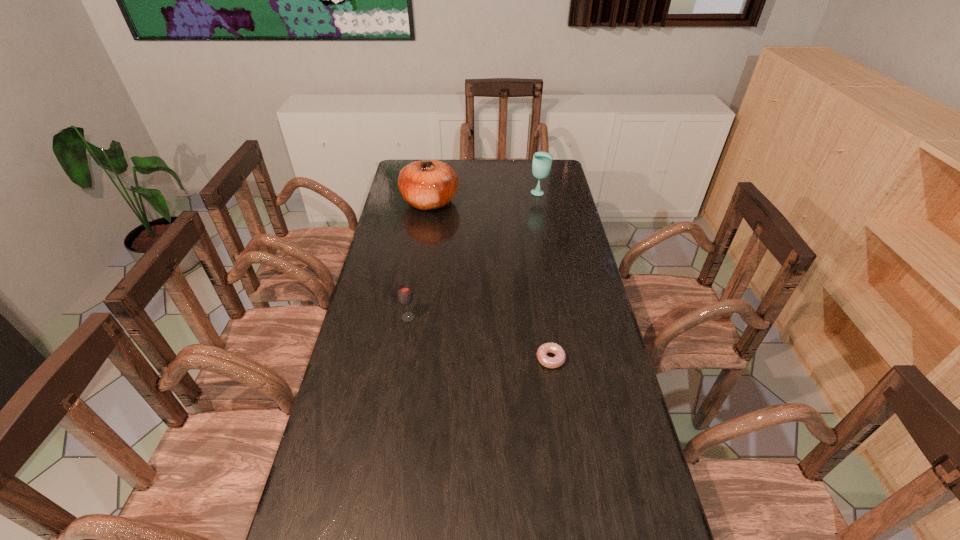
I want to click on unoccupied area between the right glass drink container and the second nearest object, so click(x=474, y=255).

The width and height of the screenshot is (960, 540). In order to click on empty space that is in between the pumpkin and the second shortest object in this screenshot , I will do `click(420, 260)`.

Locate an element on the screen. This screenshot has height=540, width=960. empty space that is in between the pumpkin and the nearer glass drink container is located at coordinates (420, 260).

Find the location of a particular element. free spot between the nearer glass drink container and the pumpkin is located at coordinates (420, 260).

Image resolution: width=960 pixels, height=540 pixels. In order to click on empty space between the pumpkin and the taller glass drink container in this screenshot , I will do `click(485, 197)`.

Find the location of a particular element. The width and height of the screenshot is (960, 540). free space that is in between the pumpkin and the shortest object is located at coordinates (491, 280).

Where is `object that is the second closest to the left glass drink container`? object that is the second closest to the left glass drink container is located at coordinates (430, 184).

Find the location of a particular element. The width and height of the screenshot is (960, 540). the third closest object to the farther glass drink container is located at coordinates (550, 362).

The image size is (960, 540). In order to click on vacant area that satisfies the following two spatial constraints: 1. on the back side of the farther glass drink container; 2. on the left side of the pumpkin in this screenshot , I will do (431, 193).

I want to click on vacant space that satisfies the following two spatial constraints: 1. on the back side of the third farthest object; 2. on the left side of the right glass drink container, so click(x=429, y=193).